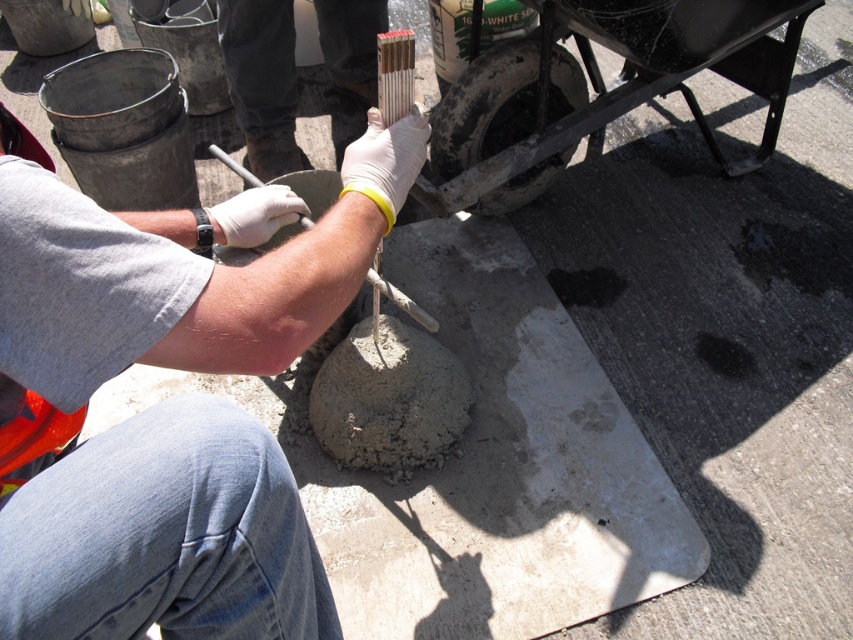
Question: Which of the following is the farthest from the observer?

Choices:
 (A) white rubber shovel at center
 (B) white matte gloves at center

Answer: (A)

Question: Is white matte gloves at center below white rubber shovel at center?

Choices:
 (A) yes
 (B) no

Answer: (A)

Question: Can you confirm if white matte gloves at center is smaller than white rubber shovel at center?

Choices:
 (A) no
 (B) yes

Answer: (B)

Question: Which point is farther from the camera taking this photo?

Choices:
 (A) (366, 273)
 (B) (26, 618)

Answer: (A)

Question: Is white matte gloves at center in front of white rubber shovel at center?

Choices:
 (A) no
 (B) yes

Answer: (B)